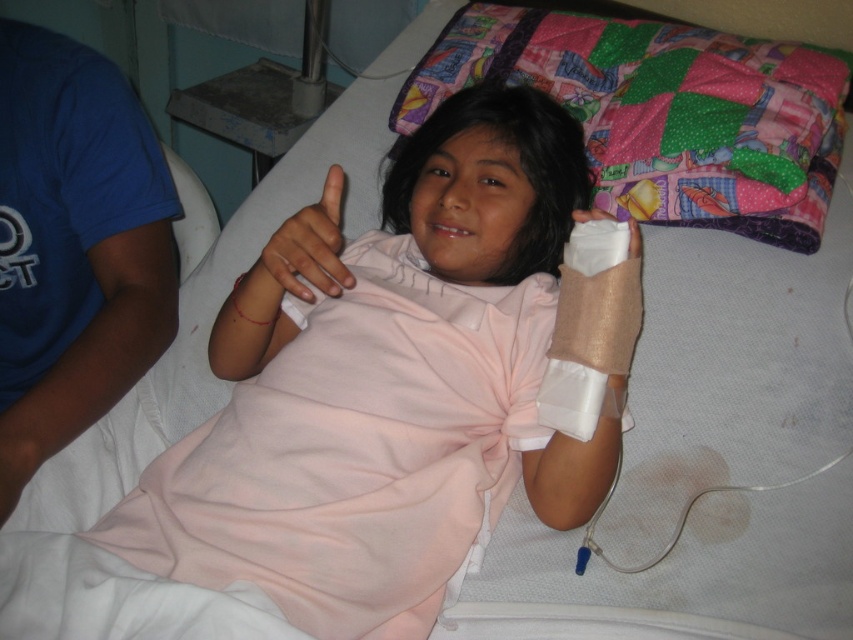
Question: Which point is closer to the camera?

Choices:
 (A) pink fabric at center
 (B) beige textured bandage at lower right
 (C) white bandage at upper right

Answer: (A)

Question: Is patchwork quilt at upper center positioned before beige textured bandage at lower right?

Choices:
 (A) no
 (B) yes

Answer: (A)

Question: Can you confirm if white bandage at center is positioned to the left of beige textured bandage at lower right?

Choices:
 (A) yes
 (B) no

Answer: (A)

Question: Which of the following is the farthest from the observer?

Choices:
 (A) (624, 227)
 (B) (555, 228)

Answer: (B)

Question: Which object is closer to the camera taking this photo?

Choices:
 (A) beige textured bandage at lower right
 (B) pink fabric at center
 (C) white bandage at center

Answer: (B)

Question: Considering the relative positions of pink fabric at center and white bandage at center in the image provided, where is pink fabric at center located with respect to white bandage at center?

Choices:
 (A) left
 (B) right

Answer: (B)